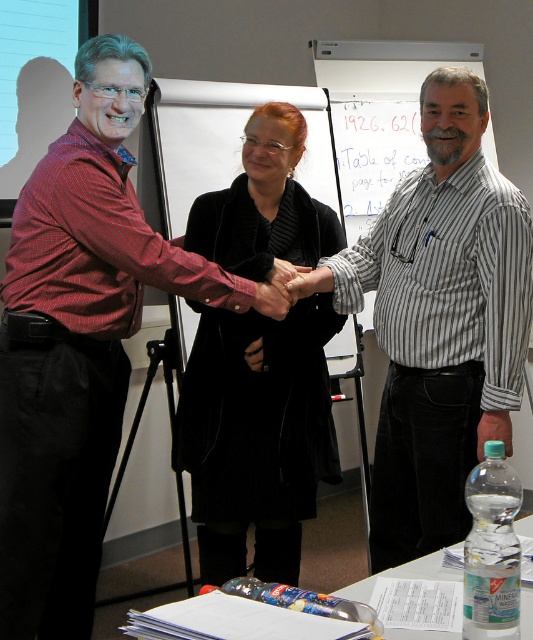
You are attending a formal event and see the red checkered shirt at left and the velvet black coat at center. Which one is positioned more to the left side of the scene?

The red checkered shirt at left is positioned more to the left side of the scene than the velvet black coat at center.

You are a photographer at the event and want to take a photo that includes both the red checkered shirt at left and the matte black hand at center. Which object should you focus on first to ensure both are in sharp focus?

You should focus on the red checkered shirt at left first since it is closer to the viewer than the matte black hand at center, ensuring both will be in focus when using a shallow depth of field.